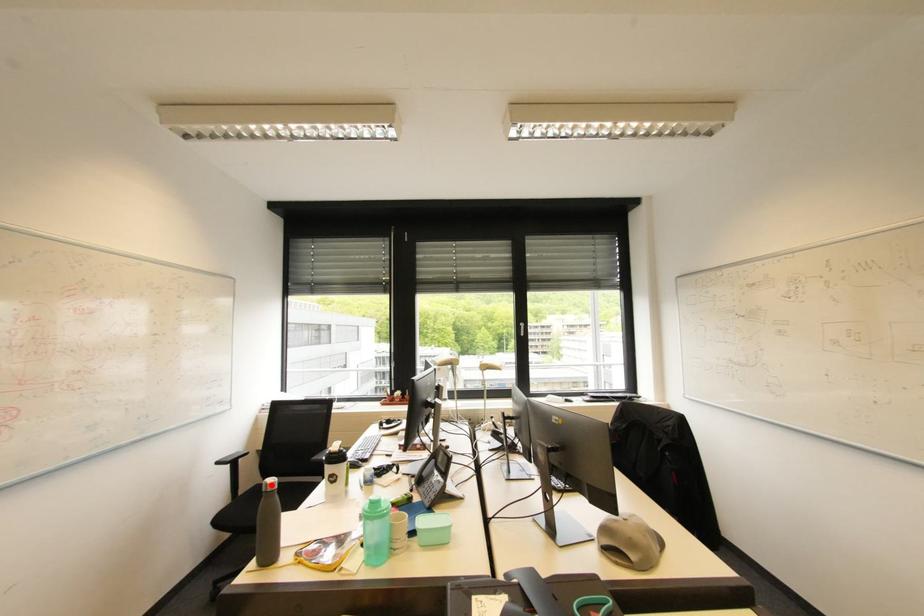
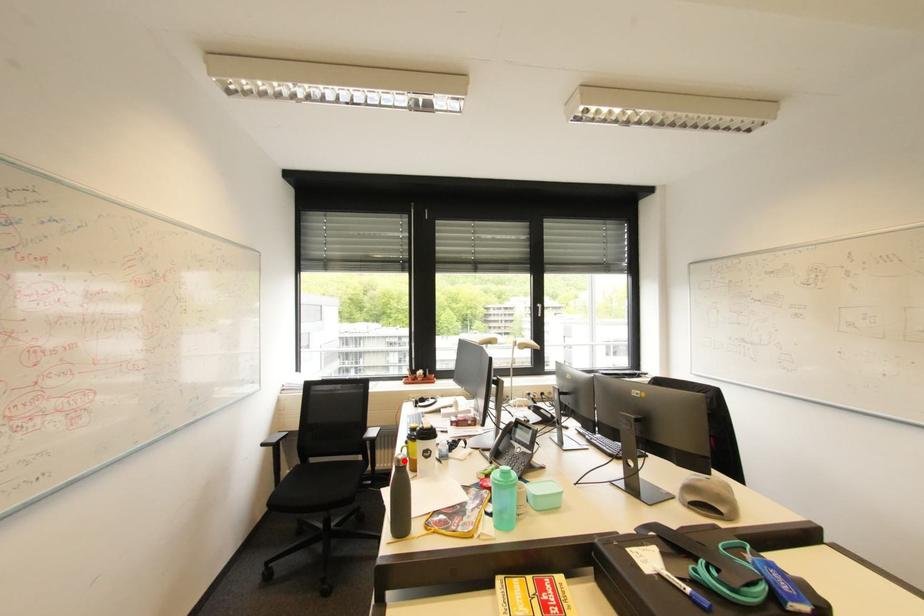
From the picture: I am providing you with two images of the same scene from different viewpoints. A red point is marked on the first image and another point is marked on the second image. Is the marked point in image1 the same physical position as the marked point in image2?

Yes